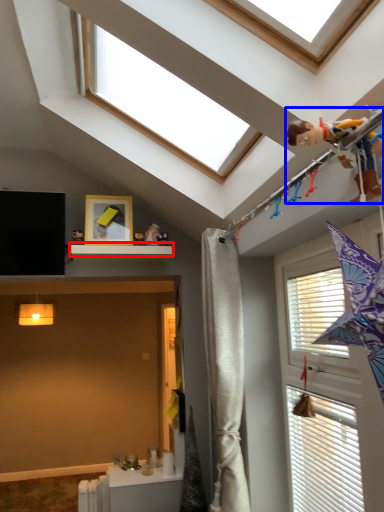
Question: Among these objects, which one is nearest to the camera, shelf (highlighted by a red box) or child (highlighted by a blue box)?

Choices:
 (A) shelf
 (B) child

Answer: (B)